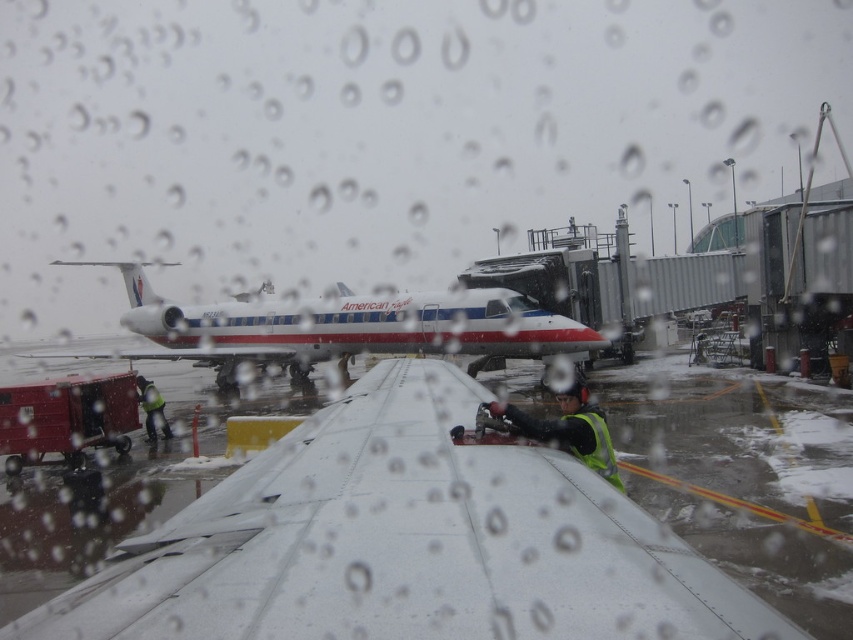
Question: Can you confirm if yellow reflective vest at center is smaller than reflective yellow safety vest at lower left?

Choices:
 (A) no
 (B) yes

Answer: (B)

Question: In this image, where is white glossy airplane at center located relative to reflective yellow safety vest at lower left?

Choices:
 (A) below
 (B) above

Answer: (B)

Question: Which is farther from the white matte airport runway at center?

Choices:
 (A) reflective yellow safety vest at lower left
 (B) yellow reflective vest at center

Answer: (A)

Question: Which object appears farthest from the camera in this image?

Choices:
 (A) reflective yellow safety vest at lower left
 (B) white matte airport runway at center

Answer: (A)

Question: Among these points, which one is nearest to the camera?

Choices:
 (A) 578,413
 (B) 158,412
 (C) 834,461
 (D) 374,328

Answer: (A)

Question: Does yellow reflective vest at center have a larger size compared to reflective yellow safety vest at lower left?

Choices:
 (A) yes
 (B) no

Answer: (B)